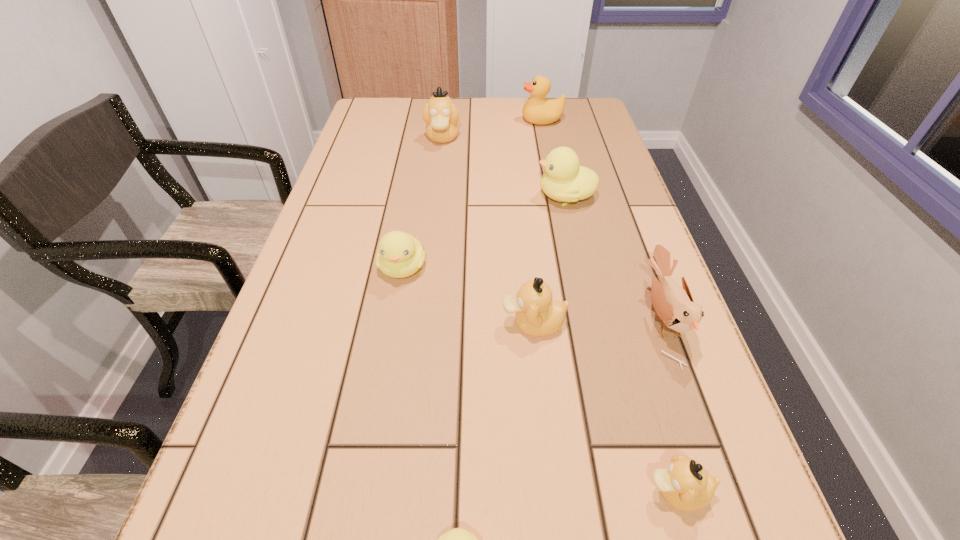
You are a GUI agent. You are given a task and a screenshot of the screen. Output one action in this format:
    pyautogui.click(x=<x>, y=<y>)
    Task: Click on the tan duckling that is the closest to the smallest yellow duckling
    The width and height of the screenshot is (960, 540).
    Given the screenshot: What is the action you would take?
    pyautogui.click(x=685, y=485)

You are a GUI agent. You are given a task and a screenshot of the screen. Output one action in this format:
    pyautogui.click(x=<x>, y=<y>)
    Task: Click on the tan duckling that is the closest to the bird
    
    Given the screenshot: What is the action you would take?
    pyautogui.click(x=537, y=314)

Find the location of a particular element. This screenshot has height=540, width=960. yellow duckling that is the second closest one to the second farthest yellow duckling is located at coordinates (458, 539).

This screenshot has width=960, height=540. Find the location of `yellow duckling that is the closest to the second farthest duckling`. yellow duckling that is the closest to the second farthest duckling is located at coordinates pos(399,255).